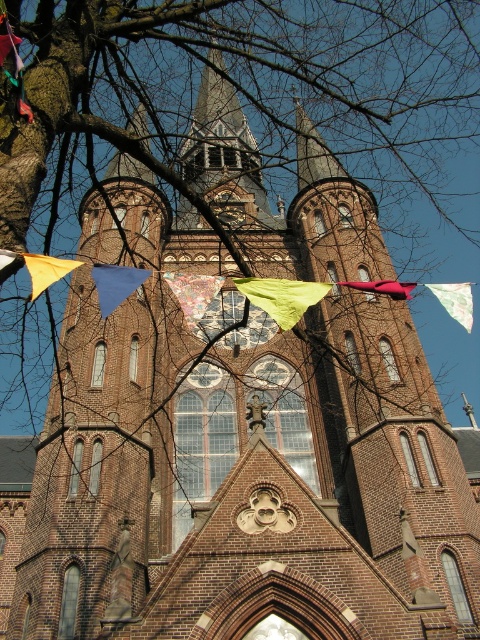
Question: Does printed fabric flag at center have a larger size compared to matte red flag at center?

Choices:
 (A) yes
 (B) no

Answer: (B)

Question: Considering the real-world distances, which object is farthest from the blue fabric flag at center?

Choices:
 (A) yellow fabric flag at center
 (B) green fabric flag at upper center

Answer: (B)

Question: Can you confirm if blue fabric flag at center is bigger than yellow fabric flag at center?

Choices:
 (A) no
 (B) yes

Answer: (A)

Question: Considering the real-world distances, which object is closest to the yellow fabric flag at center?

Choices:
 (A) matte red flag at center
 (B) printed fabric flag at center
 (C) blue fabric flag at center

Answer: (C)

Question: Which point appears closest to the camera in this image?

Choices:
 (A) coord(253,292)
 (B) coord(471,316)

Answer: (A)

Question: Where is blue fabric flag at center located in relation to matte red flag at center in the image?

Choices:
 (A) above
 (B) below

Answer: (B)